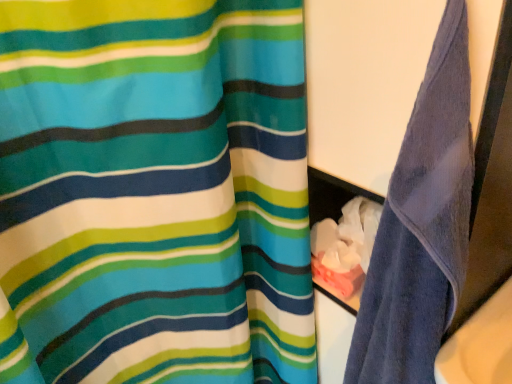
What do you see at coordinates (421, 225) in the screenshot? I see `blue soft towel at right` at bounding box center [421, 225].

Where is `blue soft towel at right`? The height and width of the screenshot is (384, 512). blue soft towel at right is located at coordinates (421, 225).

Measure the distance between blue soft towel at right and camera.

The depth of blue soft towel at right is 16.42 inches.

Find the location of a particular element. The height and width of the screenshot is (384, 512). blue soft towel at right is located at coordinates (421, 225).